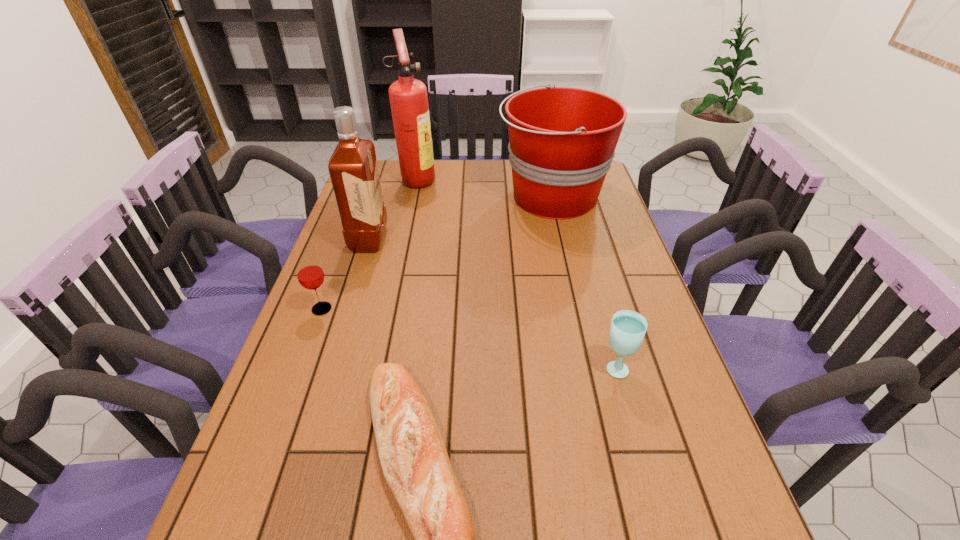
Locate an element on the screen. The height and width of the screenshot is (540, 960). fire extinguisher is located at coordinates (408, 97).

Where is `the second tallest object`? This screenshot has width=960, height=540. the second tallest object is located at coordinates (353, 169).

Where is `bucket`? This screenshot has height=540, width=960. bucket is located at coordinates (562, 140).

I want to click on the farther glass, so click(x=309, y=272).

Find the location of a particular element. the fourth farthest object is located at coordinates (309, 272).

The image size is (960, 540). Find the location of `the nearer glass`. the nearer glass is located at coordinates (x=628, y=328).

Identify the location of free space located on the front-facing side of the tallest object. Image resolution: width=960 pixels, height=540 pixels. 493,179.

Where is `vacant space located 0.310m on the front label of the liquor`? This screenshot has height=540, width=960. vacant space located 0.310m on the front label of the liquor is located at coordinates (484, 240).

I want to click on free spot located 0.340m on the front of the third tallest object, so coord(576,302).

At what (x,y) coordinates should I click in order to perform the action: click on vacant space located 0.210m on the front of the farther glass. Please return your answer as a coordinate pair (x, y). Image resolution: width=960 pixels, height=540 pixels. Looking at the image, I should click on (293, 387).